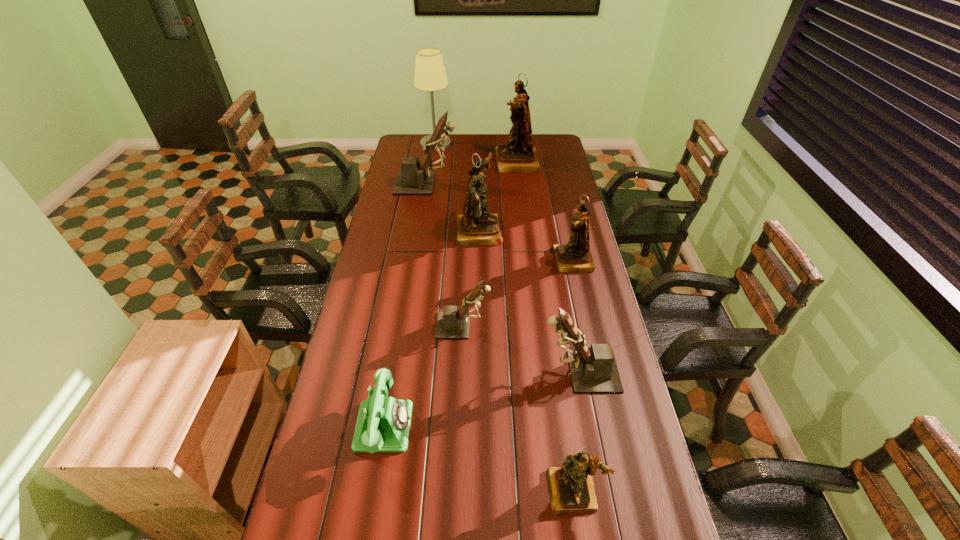
The width and height of the screenshot is (960, 540). I want to click on vacant space in between the third farthest figurine and the biggest brown figurine, so click(x=453, y=207).

You are a GUI agent. You are given a task and a screenshot of the screen. Output one action in this format:
    pyautogui.click(x=<x>, y=<y>)
    Task: Click on the vacant area between the third nearest gold figurine and the second nearest brown figurine
    Image resolution: width=960 pixels, height=540 pixels.
    Given the screenshot: What is the action you would take?
    pyautogui.click(x=471, y=278)

Identify the location of free space between the fourth farthest object and the smallest brown figurine. Image resolution: width=960 pixels, height=540 pixels. (471, 278).

At what (x,y) coordinates should I click in order to perform the action: click on vacant area that lies between the biggest gold figurine and the nearest figurine. Please return your answer as a coordinate pair (x, y). Looking at the image, I should click on (545, 327).

Find the location of a particular element. vacant area between the second nearest brown figurine and the second smallest brown figurine is located at coordinates (521, 348).

At what (x,y) coordinates should I click in order to perform the action: click on vacant space that is in between the third nearest figurine and the second nearest figurine. Please return your answer as a coordinate pair (x, y). Looking at the image, I should click on (521, 348).

Identify the location of object that is the eighth closest to the second smallest gold figurine. (430, 75).

Choose which object is the third nearest neighbor to the nearest brown figurine. Please provide its 2D coordinates. Your answer should be formatted as a tuple, i.e. [(x, y)], where the tuple contains the x and y coordinates of a point satisfying the conditions above.

[(575, 256)]

Identify the location of figurine that is the third closest to the table lamp. (476, 226).

Where is `figurine that is the second closest to the green telephone`? figurine that is the second closest to the green telephone is located at coordinates (571, 487).